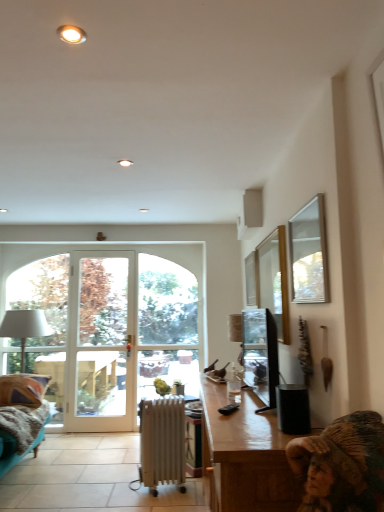
Where is `free space in front of white metallic radiator at center`? The width and height of the screenshot is (384, 512). free space in front of white metallic radiator at center is located at coordinates (157, 503).